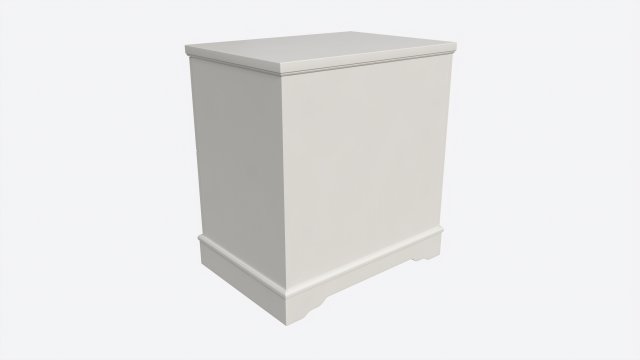
Image resolution: width=640 pixels, height=360 pixels. What are the coordinates of `white furniture` in the screenshot? It's located at click(x=346, y=168).